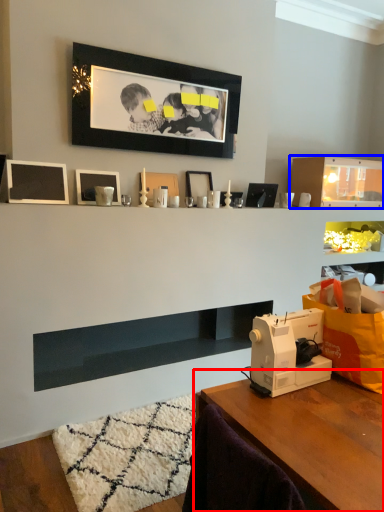
Question: Which of the following is the closest to the observer, table (highlighted by a red box) or shelf (highlighted by a blue box)?

Choices:
 (A) table
 (B) shelf

Answer: (A)